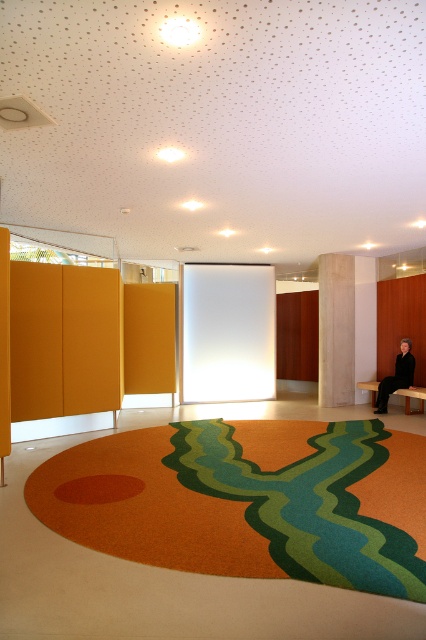
Between light brown wood pillar at right and brown wooden bench at lower right, which one is positioned lower?

brown wooden bench at lower right is lower down.

At what (x,y) coordinates should I click in order to perform the action: click on light brown wood pillar at right. Please return your answer as a coordinate pair (x, y). This screenshot has width=426, height=640. Looking at the image, I should click on (336, 330).

Is carpet at center smaller than black leather bench at lower right?

No.

Is point (394, 554) behind point (396, 358)?

That is False.

Is point (374, 566) less distant than point (389, 385)?

That is True.

Find the location of a particular element. The height and width of the screenshot is (640, 426). carpet at center is located at coordinates (307, 504).

Is black leather bench at lower right bigger than brown wooden bench at lower right?

Yes, black leather bench at lower right is bigger than brown wooden bench at lower right.

Is black leather bench at lower right smaller than brown wooden bench at lower right?

No.

Locate an element on the screen. black leather bench at lower right is located at coordinates (397, 376).